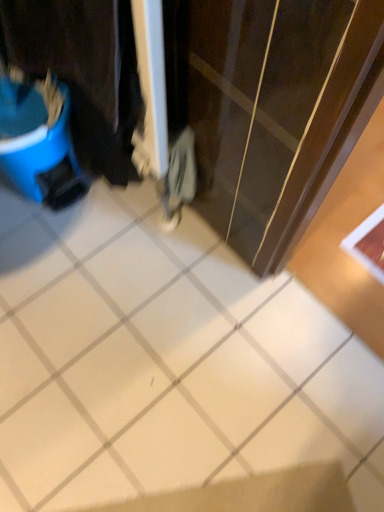
Question: Is blue plastic bucket at left bigger or smaller than white glossy tile at center?

Choices:
 (A) small
 (B) big

Answer: (B)

Question: Looking at their shapes, would you say blue plastic bucket at left is wider or thinner than white glossy tile at center?

Choices:
 (A) thin
 (B) wide

Answer: (A)

Question: Is blue plastic bucket at left to the left or to the right of white glossy tile at center in the image?

Choices:
 (A) left
 (B) right

Answer: (A)

Question: In the image, is white glossy tile at center on the left side or the right side of blue plastic bucket at left?

Choices:
 (A) left
 (B) right

Answer: (B)

Question: Does point (107, 451) appear closer or farther from the camera than point (107, 54)?

Choices:
 (A) farther
 (B) closer

Answer: (A)

Question: Is white glossy tile at center situated inside blue plastic bucket at left or outside?

Choices:
 (A) inside
 (B) outside

Answer: (B)

Question: Is white glossy tile at center wider or thinner than blue plastic bucket at left?

Choices:
 (A) wide
 (B) thin

Answer: (A)